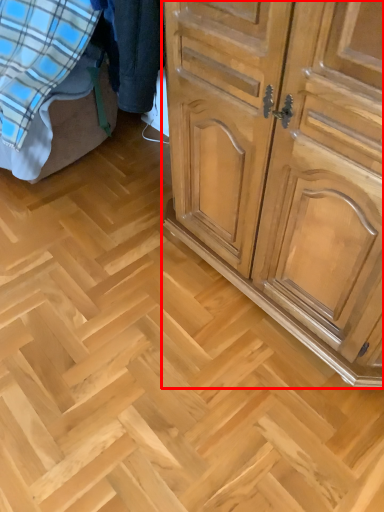
Question: Considering the relative positions of chest of drawers (annotated by the red box) and bed in the image provided, where is chest of drawers (annotated by the red box) located with respect to the staircase?

Choices:
 (A) left
 (B) right

Answer: (B)